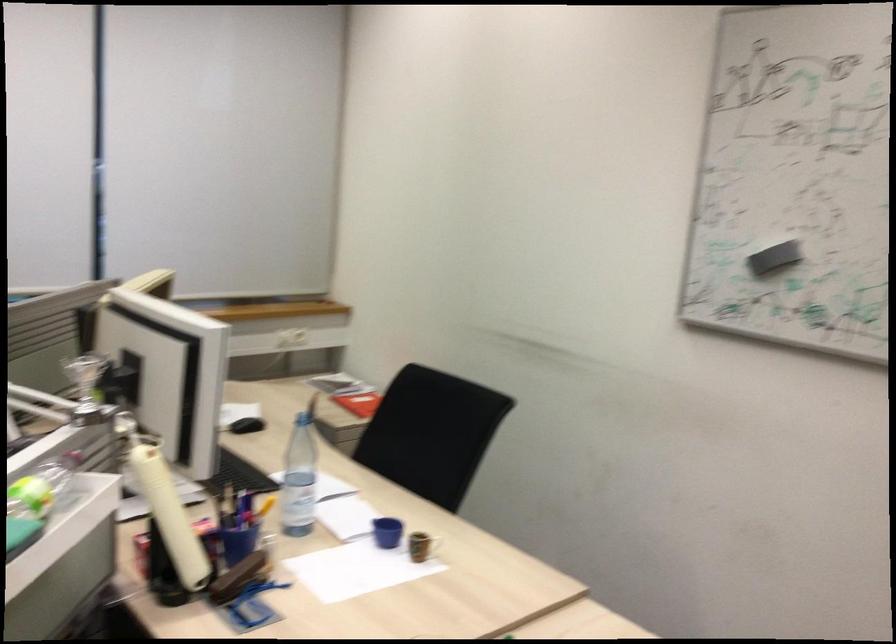
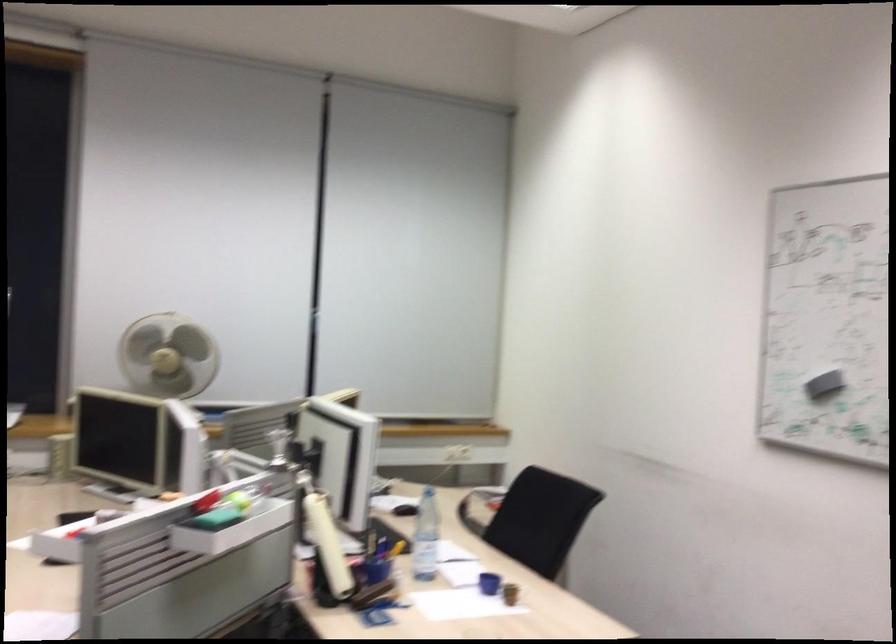
The point at (426, 544) is marked in the first image. Where is the corresponding point in the second image?

(510, 592)